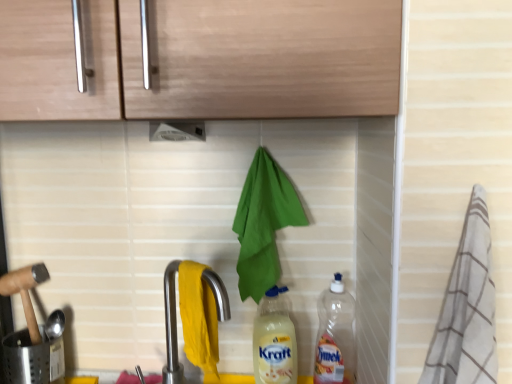
Question: From the image's perspective, is white plastic exhaust hood at upper center positioned above or below matte plastic bottle at center, the second bottle in the right-to-left sequence?

Choices:
 (A) below
 (B) above

Answer: (B)

Question: Considering the positions of white plastic exhaust hood at upper center and matte plastic bottle at center, which is the 1th bottle from left to right, in the image, is white plastic exhaust hood at upper center bigger or smaller than matte plastic bottle at center, which is the 1th bottle from left to right,?

Choices:
 (A) small
 (B) big

Answer: (A)

Question: Which object is the closest to the green fabric hand towel at center?

Choices:
 (A) satin nickel faucet at lower center
 (B) transparent plastic bottle at lower right, the 2th bottle when ordered from left to right
 (C) white striped towel at right
 (D) light wood cabinet at upper center
 (E) white plastic exhaust hood at upper center

Answer: (A)

Question: Which is farther from the white striped towel at right?

Choices:
 (A) white plastic exhaust hood at upper center
 (B) satin nickel faucet at lower center
 (C) matte plastic bottle at center, the second bottle in the right-to-left sequence
 (D) light wood cabinet at upper center
 (E) green fabric hand towel at center

Answer: (A)